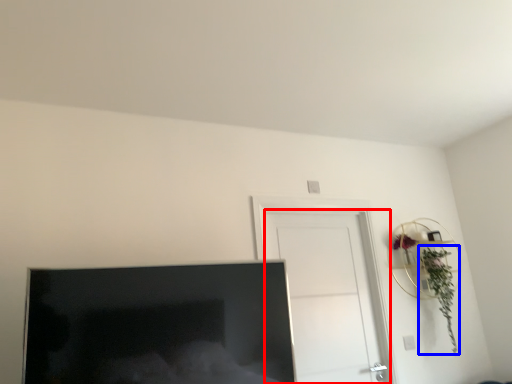
Question: Which object is closer to the camera taking this photo, door (highlighted by a red box) or plant (highlighted by a blue box)?

Choices:
 (A) door
 (B) plant

Answer: (A)